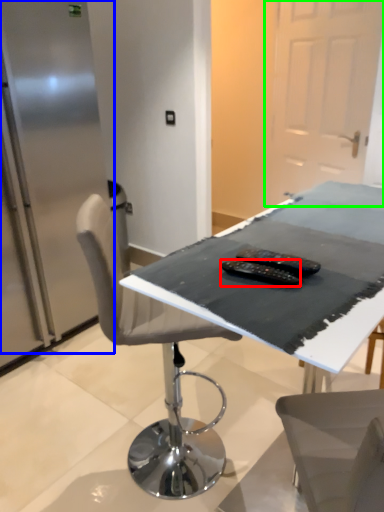
Question: Which object is the closest to the equipment (highlighted by a red box)? Choose among these: fridge (highlighted by a blue box) or glass door (highlighted by a green box).

Choices:
 (A) fridge
 (B) glass door

Answer: (A)